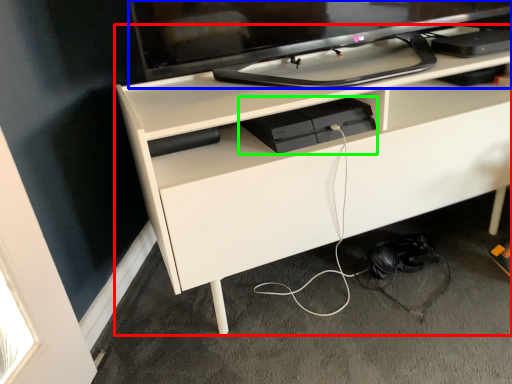
Question: Which object is positioned farthest from desk (highlighted by a red box)? Select from television (highlighted by a blue box) and equipment (highlighted by a green box).

Choices:
 (A) television
 (B) equipment

Answer: (A)